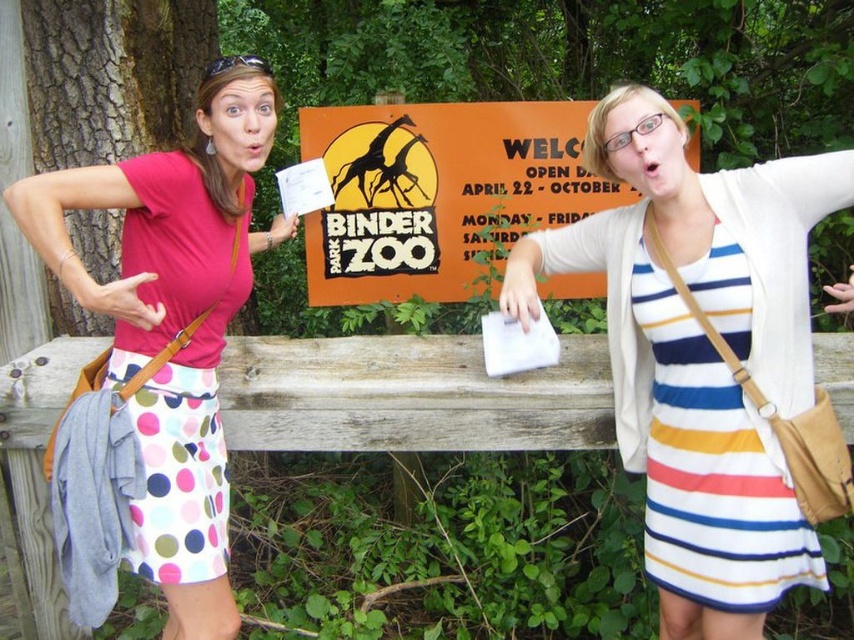
Question: Can you confirm if striped cotton dress at center is positioned to the left of orange matte sign at center?

Choices:
 (A) no
 (B) yes

Answer: (A)

Question: Which point is closer to the camera taking this photo?

Choices:
 (A) (194, 374)
 (B) (323, 248)
 (C) (817, 566)

Answer: (C)

Question: Considering the real-world distances, which object is farthest from the pink fabric shirt at left?

Choices:
 (A) striped cotton dress at center
 (B) orange matte sign at center

Answer: (A)

Question: Can you confirm if striped cotton dress at center is wider than orange matte sign at center?

Choices:
 (A) yes
 (B) no

Answer: (B)

Question: Does striped cotton dress at center appear on the left side of orange matte sign at center?

Choices:
 (A) no
 (B) yes

Answer: (A)

Question: Which object is closer to the camera taking this photo?

Choices:
 (A) striped cotton dress at center
 (B) pink fabric shirt at left
 (C) orange matte sign at center

Answer: (B)